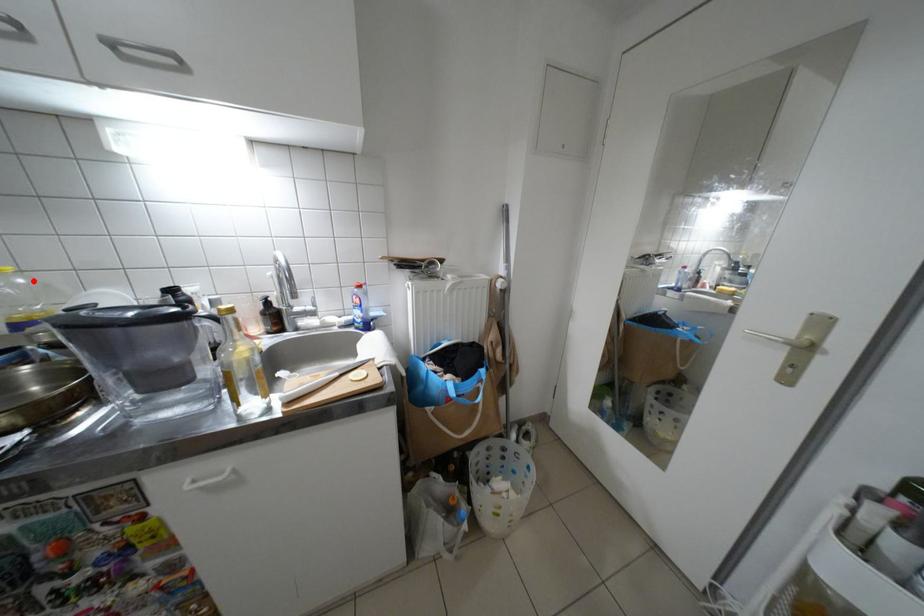
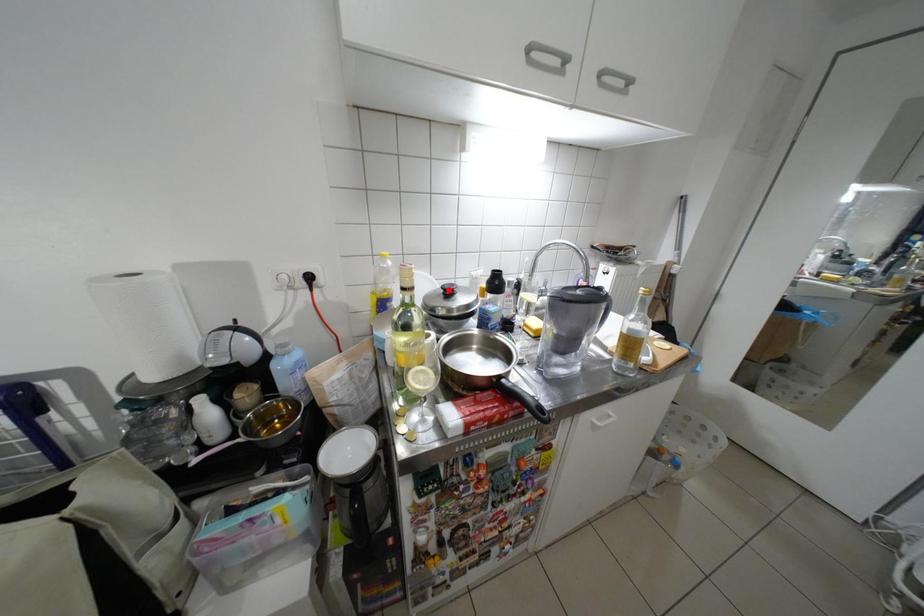
Consider the image. I am providing you with two images of the same scene from different viewpoints. A red point is marked on the first image and another point is marked on the second image. Are the points marked in image1 and image2 representing the same 3D position?

No